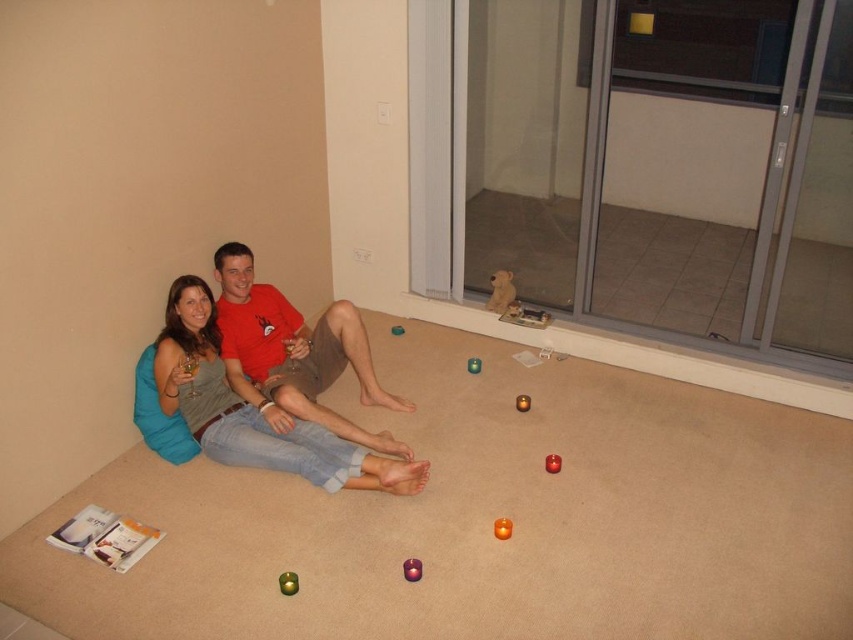
Question: Is green matte ball at lower center bigger than matte orange candle at center?

Choices:
 (A) yes
 (B) no

Answer: (B)

Question: Which point is closer to the camera taking this photo?

Choices:
 (A) (300, 348)
 (B) (527, 406)

Answer: (A)

Question: Which object is the farthest from the shiny purple mouse at center?

Choices:
 (A) orange wax candle at center
 (B) matte brown teddy bear at center
 (C) fuzzy fabric dog at upper center

Answer: (C)

Question: Considering the relative positions of matte orange candle at center and matte brown candle at center in the image provided, where is matte orange candle at center located with respect to matte brown candle at center?

Choices:
 (A) left
 (B) right

Answer: (B)

Question: Where is matte orange candle at center located in relation to matte brown teddy bear at center in the image?

Choices:
 (A) below
 (B) above

Answer: (A)

Question: Which is farther from the red cotton t-shirt at center?

Choices:
 (A) green matte ball at lower center
 (B) shiny purple mouse at center

Answer: (B)